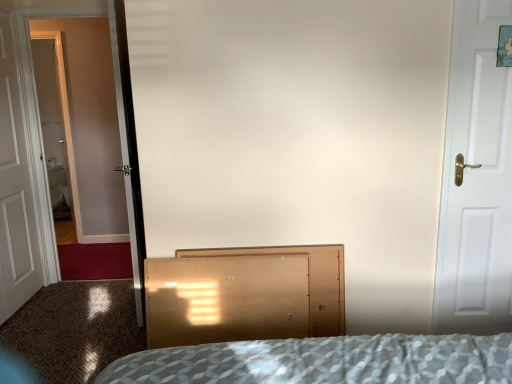
Question: Does white wooden door at left, which appears as the first door when viewed from the back, have a greater height compared to light brown wood dresser at center?

Choices:
 (A) yes
 (B) no

Answer: (A)

Question: Considering the relative sizes of white wooden door at left, which appears as the first door when viewed from the back, and light brown wood dresser at center in the image provided, is white wooden door at left, which appears as the first door when viewed from the back, bigger than light brown wood dresser at center?

Choices:
 (A) yes
 (B) no

Answer: (B)

Question: Is white wooden door at left, which appears as the first door when viewed from the back, oriented towards light brown wood dresser at center?

Choices:
 (A) yes
 (B) no

Answer: (B)

Question: Is the position of white wooden door at left, which is the second door from right to left, more distant than that of light brown wood dresser at center?

Choices:
 (A) yes
 (B) no

Answer: (A)

Question: Would you consider white wooden door at left, placed as the second door when sorted from front to back, to be distant from light brown wood dresser at center?

Choices:
 (A) no
 (B) yes

Answer: (B)

Question: From the image's perspective, is white matte door at right, arranged as the second door when viewed from the back, positioned above or below clear glass screen door at left?

Choices:
 (A) above
 (B) below

Answer: (B)

Question: Visually, is white matte door at right, arranged as the second door when viewed from the back, positioned to the left or to the right of clear glass screen door at left?

Choices:
 (A) right
 (B) left

Answer: (A)

Question: From a real-world perspective, relative to clear glass screen door at left, is white matte door at right, acting as the second door starting from the left, vertically above or below?

Choices:
 (A) above
 (B) below

Answer: (B)

Question: Is white matte door at right, acting as the second door starting from the left, taller or shorter than clear glass screen door at left?

Choices:
 (A) short
 (B) tall

Answer: (A)

Question: From a real-world perspective, relative to white matte door at right, arranged as the second door when viewed from the back, is white wooden door at left, which is the second door from right to left, vertically above or below?

Choices:
 (A) above
 (B) below

Answer: (A)

Question: Relative to white matte door at right, the 1th door viewed from the front, is white wooden door at left, placed as the second door when sorted from front to back, in front or behind?

Choices:
 (A) front
 (B) behind

Answer: (B)

Question: Considering the relative positions of white wooden door at left, which appears as the first door when viewed from the back, and white matte door at right, the 1th door viewed from the front, in the image provided, is white wooden door at left, which appears as the first door when viewed from the back, to the left or to the right of white matte door at right, the 1th door viewed from the front,?

Choices:
 (A) left
 (B) right

Answer: (A)

Question: Considering the positions of white wooden door at left, which is the second door from right to left, and white matte door at right, the 1th door viewed from the front, in the image, is white wooden door at left, which is the second door from right to left, taller or shorter than white matte door at right, the 1th door viewed from the front,?

Choices:
 (A) tall
 (B) short

Answer: (A)

Question: Relative to white wooden door at left, placed as the second door when sorted from front to back, is light brown wood dresser at center in front or behind?

Choices:
 (A) behind
 (B) front

Answer: (B)

Question: From the image's perspective, relative to white wooden door at left, placed as the second door when sorted from front to back, is light brown wood dresser at center above or below?

Choices:
 (A) below
 (B) above

Answer: (A)